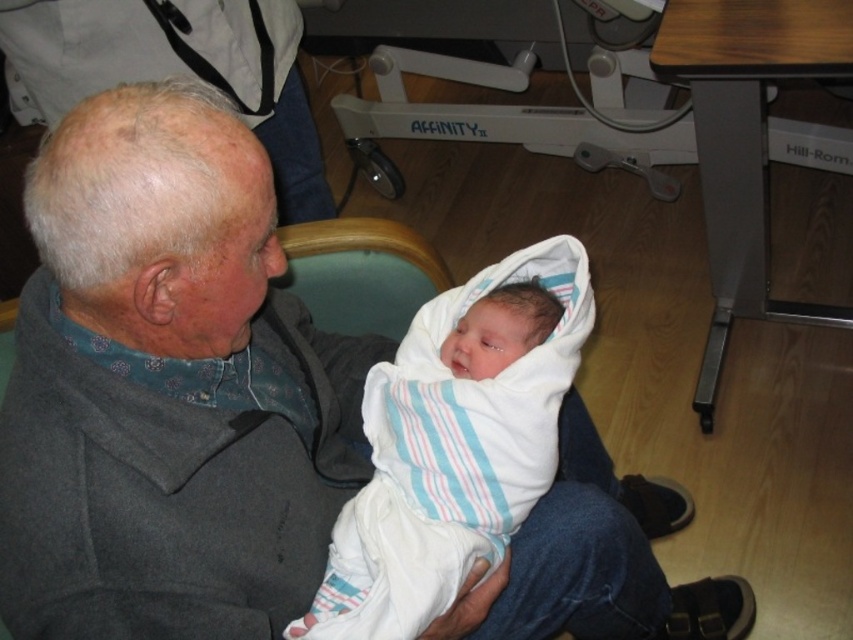
Is gray woolen sweater at upper left closer to the viewer compared to white striped swaddle at center?

No, gray woolen sweater at upper left is further to the viewer.

Is point (155, 72) behind point (506, 289)?

Yes, point (155, 72) is behind point (506, 289).

Is point (178, 72) closer to viewer compared to point (288, 632)?

No.

Locate an element on the screen. gray woolen sweater at upper left is located at coordinates (178, 68).